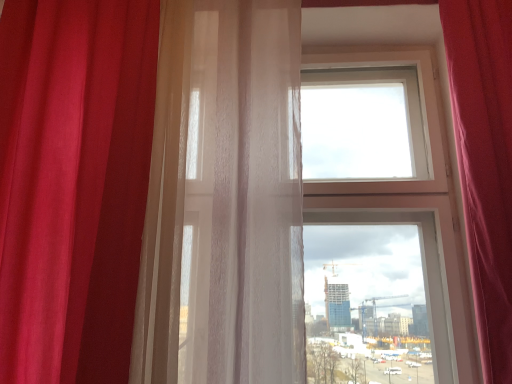
Question: From the image's perspective, is translucent white curtain at left, which ranks as the second curtain in right-to-left order, over velvet red curtain at right, the third curtain in the left-to-right sequence?

Choices:
 (A) no
 (B) yes

Answer: (B)

Question: From a real-world perspective, is translucent white curtain at left, which ranks as the second curtain in left-to-right order, on top of velvet red curtain at right, which is counted as the first curtain, starting from the right?

Choices:
 (A) no
 (B) yes

Answer: (B)

Question: Considering the relative sizes of translucent white curtain at left, which ranks as the second curtain in left-to-right order, and velvet red curtain at right, which is counted as the first curtain, starting from the right, in the image provided, is translucent white curtain at left, which ranks as the second curtain in left-to-right order, bigger than velvet red curtain at right, which is counted as the first curtain, starting from the right,?

Choices:
 (A) no
 (B) yes

Answer: (B)

Question: Considering the relative sizes of translucent white curtain at left, which ranks as the second curtain in left-to-right order, and velvet red curtain at right, which is counted as the first curtain, starting from the right, in the image provided, is translucent white curtain at left, which ranks as the second curtain in left-to-right order, taller than velvet red curtain at right, which is counted as the first curtain, starting from the right,?

Choices:
 (A) no
 (B) yes

Answer: (B)

Question: Is translucent white curtain at left, which ranks as the second curtain in right-to-left order, looking in the opposite direction of velvet red curtain at right, the third curtain in the left-to-right sequence?

Choices:
 (A) no
 (B) yes

Answer: (A)

Question: From the image's perspective, is translucent white curtain at left, which ranks as the second curtain in right-to-left order, located above or below satin red curtain at left, marked as the first curtain in a left-to-right arrangement?

Choices:
 (A) below
 (B) above

Answer: (A)

Question: Based on their sizes in the image, would you say translucent white curtain at left, which ranks as the second curtain in right-to-left order, is bigger or smaller than satin red curtain at left, marked as the first curtain in a left-to-right arrangement?

Choices:
 (A) big
 (B) small

Answer: (B)

Question: Considering the positions of translucent white curtain at left, which ranks as the second curtain in right-to-left order, and satin red curtain at left, marked as the first curtain in a left-to-right arrangement, in the image, is translucent white curtain at left, which ranks as the second curtain in right-to-left order, wider or thinner than satin red curtain at left, marked as the first curtain in a left-to-right arrangement,?

Choices:
 (A) wide
 (B) thin

Answer: (B)

Question: Does point (278, 205) appear closer or farther from the camera than point (117, 109)?

Choices:
 (A) farther
 (B) closer

Answer: (B)

Question: Is satin red curtain at left, marked as the first curtain in a left-to-right arrangement, wider or thinner than translucent white curtain at left, which ranks as the second curtain in right-to-left order?

Choices:
 (A) wide
 (B) thin

Answer: (A)

Question: Considering their positions, is satin red curtain at left, which ranks as the 3th curtain in right-to-left order, located in front of or behind translucent white curtain at left, which ranks as the second curtain in right-to-left order?

Choices:
 (A) front
 (B) behind

Answer: (A)

Question: From the image's perspective, is satin red curtain at left, marked as the first curtain in a left-to-right arrangement, located above or below translucent white curtain at left, which ranks as the second curtain in left-to-right order?

Choices:
 (A) above
 (B) below

Answer: (A)

Question: Visually, is satin red curtain at left, marked as the first curtain in a left-to-right arrangement, positioned to the left or to the right of translucent white curtain at left, which ranks as the second curtain in right-to-left order?

Choices:
 (A) right
 (B) left

Answer: (B)

Question: Visually, is satin red curtain at left, marked as the first curtain in a left-to-right arrangement, positioned to the left or to the right of velvet red curtain at right, the third curtain in the left-to-right sequence?

Choices:
 (A) right
 (B) left

Answer: (B)

Question: Considering their positions, is satin red curtain at left, marked as the first curtain in a left-to-right arrangement, located in front of or behind velvet red curtain at right, which is counted as the first curtain, starting from the right?

Choices:
 (A) behind
 (B) front

Answer: (A)